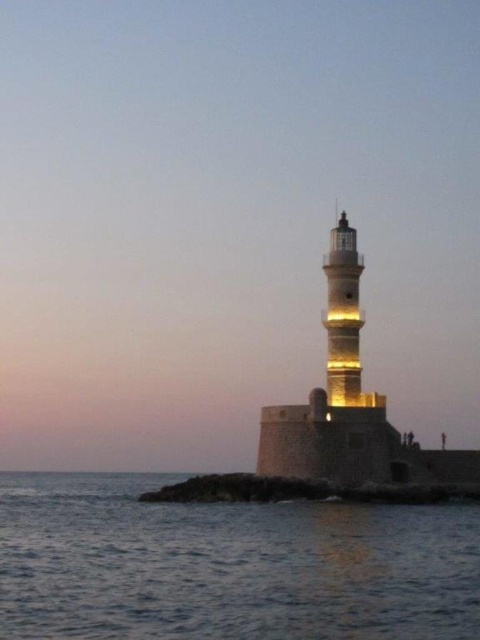
You are a photographer standing at the lighthouse and want to capture the blue water at lower left in your shot. Based on its coordinates, where should you position your camera to include it in the frame?

The blue water at lower left is located at coordinates point (228, 564). To include it in the frame, position your camera so that the lower left area of the image captures this point.

You are standing on a boat 20 meters away from the yellowish stone tower at center. You want to reach the blue water at lower left. Can you reach it without getting off the boat?

The blue water at lower left is 26.65 meters from the yellowish stone tower at center. Since you are 20 meters away from the tower, you are still 6.65 meters away from the blue water at lower left. Therefore, you cannot reach it without getting off the boat.

You are a photographer aiming to capture the lighthouse and the surrounding water in a single shot. Given that the blue water at lower left and the yellowish stone tower at center are both in your viewfinder, which object occupies a bigger portion of the frame?

The blue water at lower left has a larger size compared to the yellowish stone tower at center, so it occupies a bigger portion of the frame.